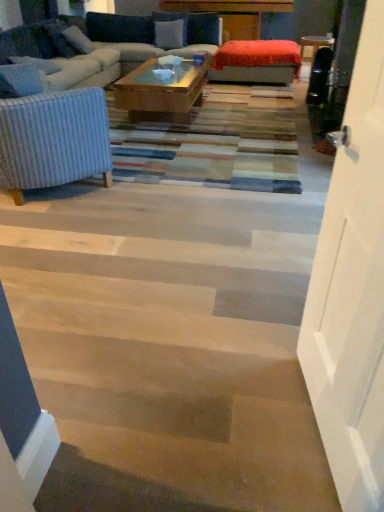
In order to face white textured pillow at upper left, which is counted as the first pillow, starting from the front, should I rotate leftwards or rightwards?

Turn left approximately 20.113 degrees to face it.

I want to click on white textured pillow at upper left, which is counted as the first pillow, starting from the front, so click(x=38, y=63).

The height and width of the screenshot is (512, 384). In order to click on velvet blue couch at upper left in this screenshot , I will do `click(106, 46)`.

Find the location of `white wood door at right`. white wood door at right is located at coordinates 352,289.

The image size is (384, 512). What do you see at coordinates (78, 39) in the screenshot?
I see `white fabric pillow at upper left, the second pillow ordered from the bottom` at bounding box center [78, 39].

The width and height of the screenshot is (384, 512). What do you see at coordinates (169, 34) in the screenshot?
I see `velvet blue pillow at upper center, the second pillow viewed from the top` at bounding box center [169, 34].

Image resolution: width=384 pixels, height=512 pixels. I want to click on white textured pillow at upper left, which appears as the 4th pillow when viewed from the back, so [x=38, y=63].

From a real-world perspective, which is physically below, wooden floor at lower left or blue fabric pillow at upper center, marked as the 1th pillow in a top-to-bottom arrangement?

wooden floor at lower left, from a real-world perspective.

The width and height of the screenshot is (384, 512). Find the location of `the 2nd pillow counting from the left side of the wooden floor at lower left`. the 2nd pillow counting from the left side of the wooden floor at lower left is located at coordinates (119, 28).

In terms of size, does wooden floor at lower left appear bigger or smaller than blue fabric pillow at upper center, acting as the fourth pillow starting from the front?

Clearly, wooden floor at lower left is larger in size than blue fabric pillow at upper center, acting as the fourth pillow starting from the front.

Who is more distant, velvet blue pillow at upper center, the second pillow viewed from the top, or white textured pillow at upper left, marked as the 1th pillow in a bottom-to-top arrangement?

velvet blue pillow at upper center, the second pillow viewed from the top, is more distant.

Is point (173, 41) positioned before point (53, 73)?

No.

Would you say velvet blue pillow at upper center, acting as the 3th pillow starting from the front, is inside or outside white textured pillow at upper left, marked as the 1th pillow in a bottom-to-top arrangement?

velvet blue pillow at upper center, acting as the 3th pillow starting from the front, is not inside white textured pillow at upper left, marked as the 1th pillow in a bottom-to-top arrangement, it's outside.

From the image's perspective, which one is positioned lower, velvet blue pillow at upper center, the 3th pillow ordered from the bottom, or white textured pillow at upper left, which is counted as the first pillow, starting from the front?

white textured pillow at upper left, which is counted as the first pillow, starting from the front, from the image's perspective.

Considering the positions of objects white wood door at right and velvet orange ottoman at center in the image provided, who is more to the left, white wood door at right or velvet orange ottoman at center?

From the viewer's perspective, white wood door at right appears more on the left side.

From a real-world perspective, is white wood door at right under velvet orange ottoman at center?

Incorrect, from a real-world perspective, white wood door at right is higher than velvet orange ottoman at center.

Which is in front, white wood door at right or velvet orange ottoman at center?

white wood door at right is closer to the camera.

Does velvet orange ottoman at center touch velvet blue couch at upper left?

They are not placed beside each other.

Would you say velvet orange ottoman at center is to the left or to the right of velvet blue couch at upper left in the picture?

From the image, it's evident that velvet orange ottoman at center is to the right of velvet blue couch at upper left.

From the image's perspective, is velvet orange ottoman at center on velvet blue couch at upper left?

Indeed, from the image's perspective, velvet orange ottoman at center is shown above velvet blue couch at upper left.

Between velvet blue pillow at upper center, the 3th pillow ordered from the bottom, and wooden floor at lower left, which one has smaller width?

velvet blue pillow at upper center, the 3th pillow ordered from the bottom.

Considering the relative sizes of velvet blue pillow at upper center, the 3th pillow ordered from the bottom, and wooden floor at lower left in the image provided, is velvet blue pillow at upper center, the 3th pillow ordered from the bottom, taller than wooden floor at lower left?

Yes, velvet blue pillow at upper center, the 3th pillow ordered from the bottom, is taller than wooden floor at lower left.

Is velvet blue pillow at upper center, the 3th pillow ordered from the bottom, turned away from wooden floor at lower left?

No.

In the scene shown: Between velvet blue pillow at upper center, acting as the second pillow starting from the back, and wooden floor at lower left, which one appears on the right side from the viewer's perspective?

wooden floor at lower left.

Considering the sizes of white fabric pillow at upper left, acting as the third pillow starting from the top, and white textured pillow at upper left, which is counted as the first pillow, starting from the front, in the image, is white fabric pillow at upper left, acting as the third pillow starting from the top, wider or thinner than white textured pillow at upper left, which is counted as the first pillow, starting from the front,?

Clearly, white fabric pillow at upper left, acting as the third pillow starting from the top, has less width compared to white textured pillow at upper left, which is counted as the first pillow, starting from the front.

In the image, is white fabric pillow at upper left, marked as the third pillow in a back-to-front arrangement, on the left side or the right side of white textured pillow at upper left, which is counted as the first pillow, starting from the front?

white fabric pillow at upper left, marked as the third pillow in a back-to-front arrangement, is positioned on white textured pillow at upper left, which is counted as the first pillow, starting from the front,'s right side.

Is point (86, 40) behind point (14, 57)?

Yes, point (86, 40) is farther from viewer.

From a real-world perspective, who is located lower, white fabric pillow at upper left, the second pillow ordered from the bottom, or white textured pillow at upper left, which is counted as the first pillow, starting from the front?

In real-world perspective, white textured pillow at upper left, which is counted as the first pillow, starting from the front, is lower.

Is white textured pillow at upper left, marked as the 1th pillow in a bottom-to-top arrangement, oriented away from wooden floor at lower left?

No, white textured pillow at upper left, marked as the 1th pillow in a bottom-to-top arrangement,'s orientation is not away from wooden floor at lower left.

Which is more to the left, white textured pillow at upper left, which is counted as the first pillow, starting from the front, or wooden floor at lower left?

white textured pillow at upper left, which is counted as the first pillow, starting from the front.

Is white textured pillow at upper left, marked as the 1th pillow in a bottom-to-top arrangement, wider or thinner than wooden floor at lower left?

Clearly, white textured pillow at upper left, marked as the 1th pillow in a bottom-to-top arrangement, has less width compared to wooden floor at lower left.

Is point (52, 70) positioned in front of point (201, 430)?

No, (52, 70) is behind (201, 430).

Find the location of a particular element. the 4th pillow behind when counting from the wooden floor at lower left is located at coordinates (119, 28).

Locate an element on the screen. This screenshot has height=512, width=384. pillow that is the 1st one above the white textured pillow at upper left, marked as the 1th pillow in a bottom-to-top arrangement (from a real-world perspective) is located at coordinates (169, 34).

Looking at this image, estimate the real-world distances between objects in this image. Which object is closer to wooden floor at lower left, velvet blue couch at upper left or white fabric pillow at upper left, the second pillow ordered from the bottom?

velvet blue couch at upper left is positioned closer to the anchor wooden floor at lower left.

Based on their spatial positions, is velvet blue pillow at upper center, acting as the 3th pillow starting from the front, or velvet orange ottoman at center further from white textured pillow at upper left, marked as the 1th pillow in a bottom-to-top arrangement?

velvet orange ottoman at center is positioned further to the anchor white textured pillow at upper left, marked as the 1th pillow in a bottom-to-top arrangement.

When comparing their distances from wooden floor at lower left, does white textured pillow at upper left, which appears as the 4th pillow when viewed from the back, or blue fabric pillow at upper center, acting as the fourth pillow starting from the front, seem closer?

white textured pillow at upper left, which appears as the 4th pillow when viewed from the back, is closer to wooden floor at lower left.

Looking at the image, which one is located closer to velvet orange ottoman at center, velvet blue couch at upper left or white wood door at right?

The object closer to velvet orange ottoman at center is velvet blue couch at upper left.

When comparing their distances from velvet blue couch at upper left, does wooden floor at lower left or white fabric pillow at upper left, acting as the third pillow starting from the top, seem closer?

Based on the image, white fabric pillow at upper left, acting as the third pillow starting from the top, appears to be nearer to velvet blue couch at upper left.

Based on their spatial positions, is white textured pillow at upper left, the 4th pillow viewed from the top, or velvet orange ottoman at center further from blue fabric pillow at upper center, acting as the fourth pillow starting from the front?

The object further to blue fabric pillow at upper center, acting as the fourth pillow starting from the front, is white textured pillow at upper left, the 4th pillow viewed from the top.

Based on their spatial positions, is white wood door at right or white textured pillow at upper left, which appears as the 4th pillow when viewed from the back, further from blue fabric pillow at upper center, marked as the 1th pillow in a top-to-bottom arrangement?

white wood door at right.

Estimate the real-world distances between objects in this image. Which object is further from velvet blue pillow at upper center, the second pillow viewed from the top, white fabric pillow at upper left, which is the second pillow from front to back, or white textured pillow at upper left, which is counted as the first pillow, starting from the front?

Among the two, white textured pillow at upper left, which is counted as the first pillow, starting from the front, is located further to velvet blue pillow at upper center, the second pillow viewed from the top.

Identify the location of stairwell between white wood door at right and velvet blue pillow at upper center, the 3th pillow ordered from the bottom, from front to back. (167, 362).

Where is `studio couch located between white wood door at right and velvet blue pillow at upper center, the second pillow viewed from the top, in the depth direction`? studio couch located between white wood door at right and velvet blue pillow at upper center, the second pillow viewed from the top, in the depth direction is located at coordinates (106, 46).

The width and height of the screenshot is (384, 512). In order to click on studio couch between white wood door at right and white textured pillow at upper left, which is counted as the first pillow, starting from the front, in the front-back direction in this screenshot , I will do `click(106, 46)`.

Image resolution: width=384 pixels, height=512 pixels. What are the coordinates of `wide between white wood door at right and velvet blue pillow at upper center, the 3th pillow ordered from the bottom, in the front-back direction` in the screenshot? It's located at (257, 62).